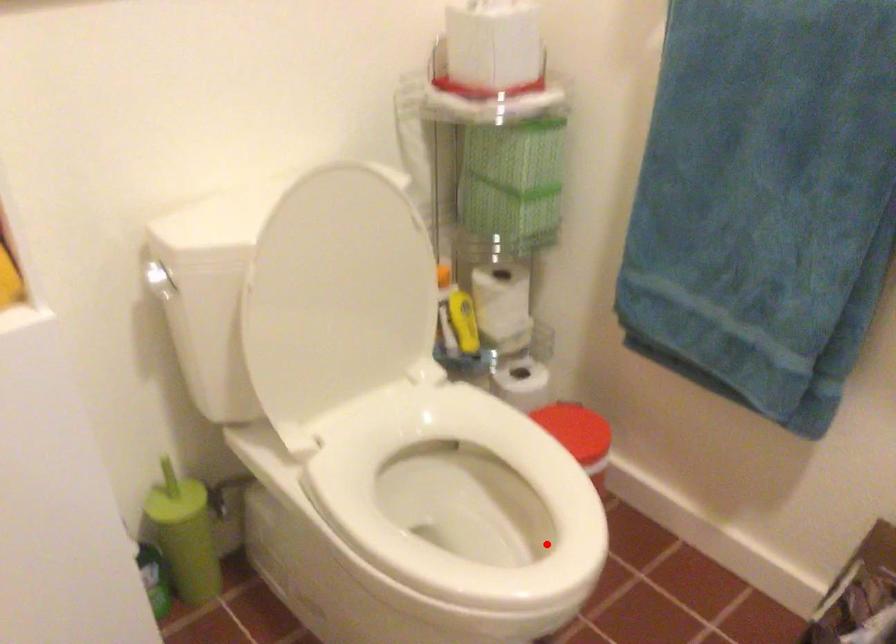
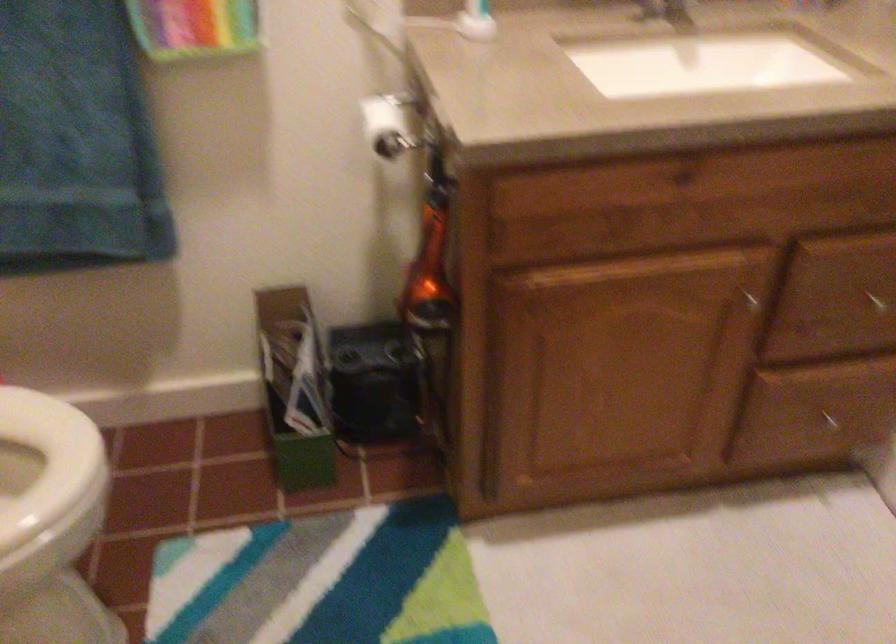
Find the pixel in the second image that matches the highlighted location in the first image.

(47, 466)